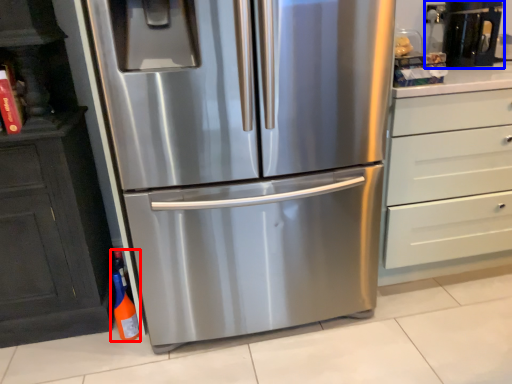
Question: Which of the following is the farthest to the observer, bottle (highlighted by a red box) or coffee machine (highlighted by a blue box)?

Choices:
 (A) bottle
 (B) coffee machine

Answer: (B)